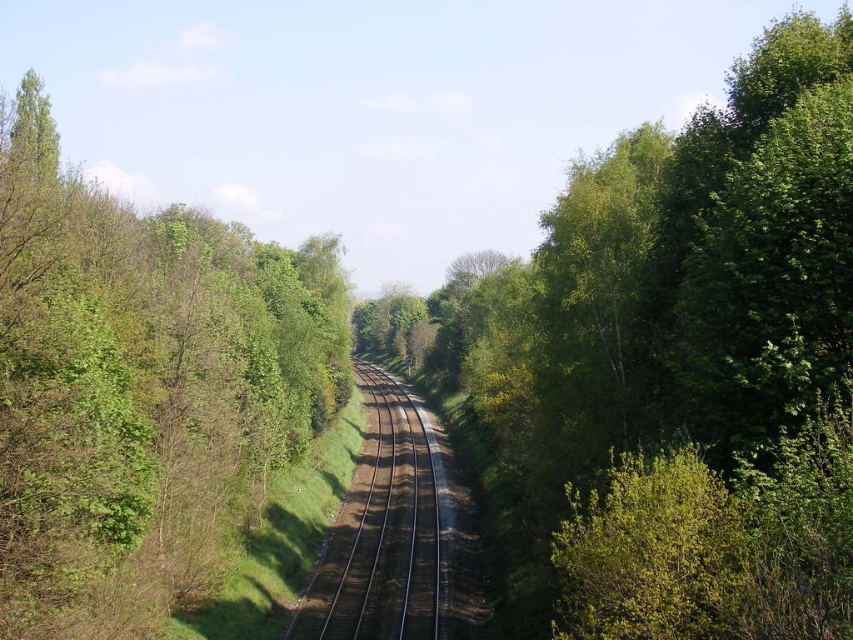
You are standing at the starting point of the railway track and want to reach a destination located at point (424, 582). There is an obstacle at point (83, 540). Which point should you avoid to safely reach your destination?

You should avoid the point (83, 540) because it is closer to the camera than point (424, 582), meaning it is in front of the obstacle and blocking the path.